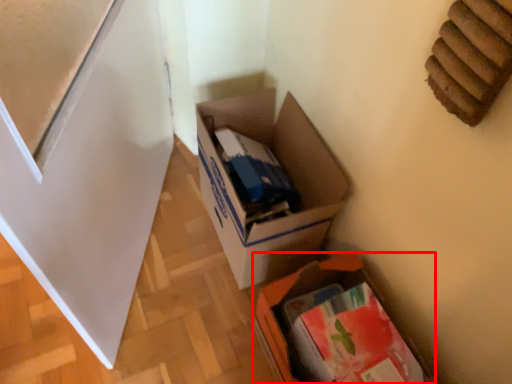
Question: From the image's perspective, where is box (annotated by the red box) located relative to box?

Choices:
 (A) above
 (B) below

Answer: (B)